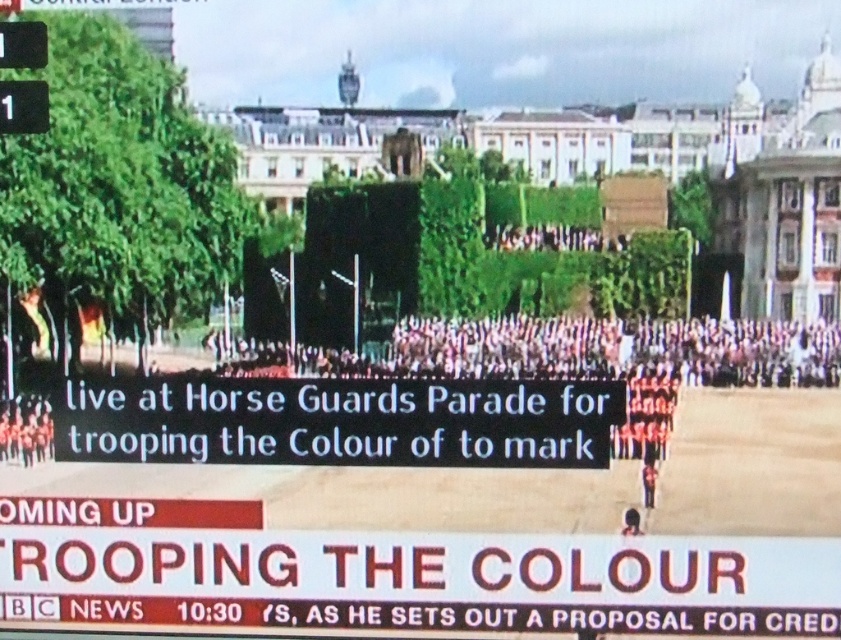
You are a photographer standing at the front of the Horse Guards Parade in London, aiming to capture a closeup shot of the pink fabric crowd at center. Given that your camera has a maximum zoom range of 100 feet, will you be able to get a clear closeup without moving closer?

The pink fabric crowd at center is 327.98 feet from viewer. Since your camera can only zoom up to 100 feet, you will not be able to capture a clear closeup without moving closer.

You are a photographer trying to capture a clear shot of the black plastic sign at center and the pink fabric crowd at center during the military parade. Based on their heights, which object would appear taller in your photo?

The black plastic sign at center appears taller in the photo because it has a greater height compared to the pink fabric crowd at center.

You are a drone operator trying to capture a closeup of the point at coordinates (505,371) during the military parade. The camera is currently positioned 331.76 feet away from the point. If you move the camera 100 feet closer, will the point become larger in the frame?

Moving the camera 100 feet closer would reduce the distance to 231.76 feet. Since the point is now closer to the camera, it would appear larger in the frame.